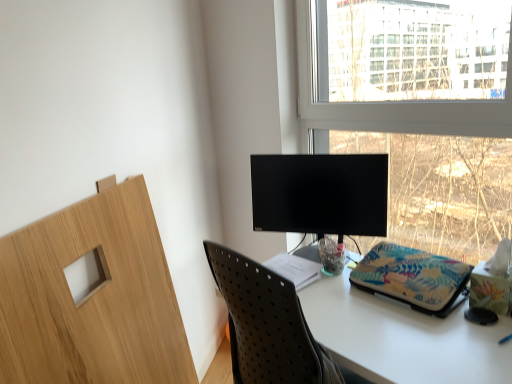
Identify the location of free spot in front of white paper at center. The image size is (512, 384). (322, 304).